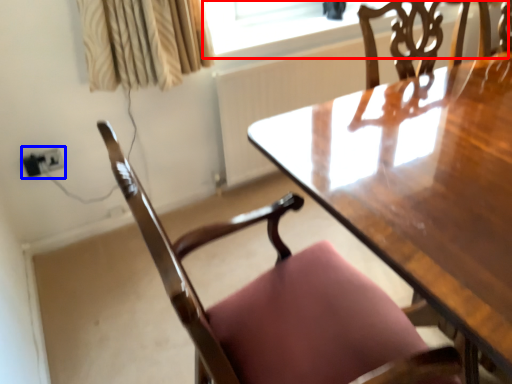
Question: Which object appears closest to the camera in this image, window screen (highlighted by a red box) or electric outlet (highlighted by a blue box)?

Choices:
 (A) window screen
 (B) electric outlet

Answer: (B)